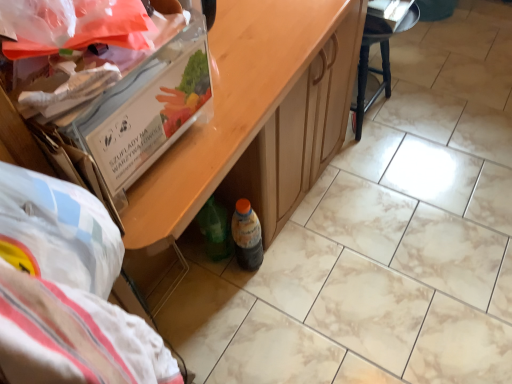
Question: From a real-world perspective, is translucent plastic bottle at lower center physically located above or below wooden table at center?

Choices:
 (A) below
 (B) above

Answer: (A)

Question: From their relative heights in the image, would you say translucent plastic bottle at lower center is taller or shorter than wooden table at center?

Choices:
 (A) short
 (B) tall

Answer: (A)

Question: Which is nearer to the translucent plastic bottle at lower center?

Choices:
 (A) black wood stool at upper right
 (B) wooden table at center

Answer: (B)

Question: Which object is the closest to the black wood stool at upper right?

Choices:
 (A) translucent plastic bottle at lower center
 (B) wooden table at center

Answer: (B)